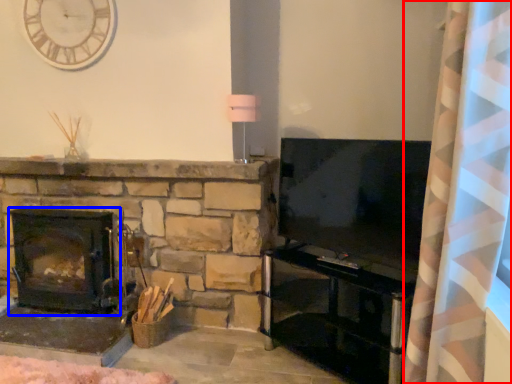
Question: Which object appears farthest to the camera in this image, curtain (highlighted by a red box) or wood burning stove (highlighted by a blue box)?

Choices:
 (A) curtain
 (B) wood burning stove

Answer: (B)